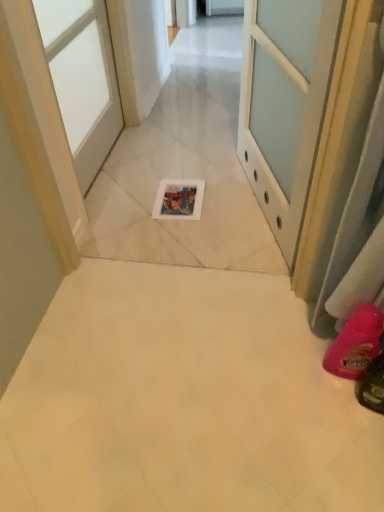
Where is `free spot behind pink rubber boot at lower right`? free spot behind pink rubber boot at lower right is located at coordinates (303, 324).